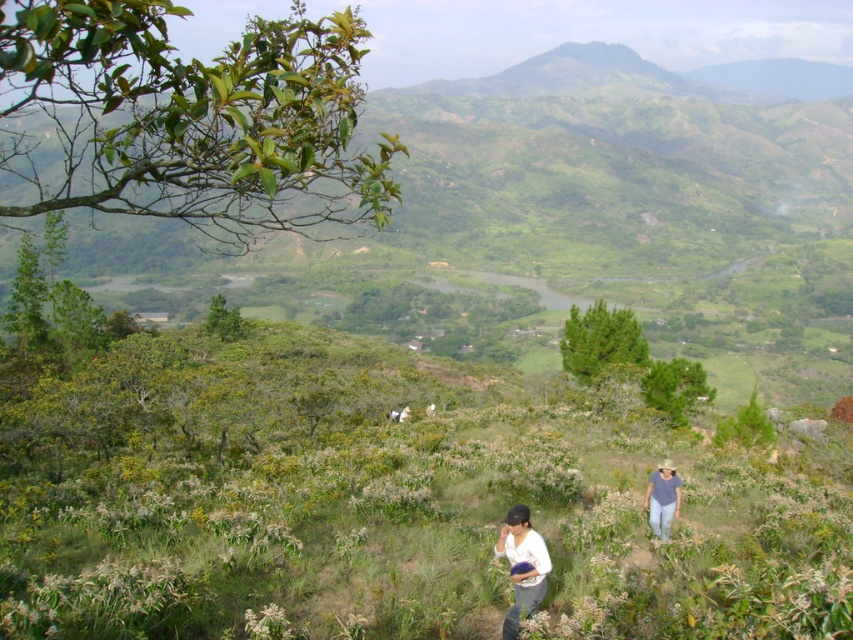
Question: Can you confirm if green leafy grass at center is positioned above denim shirt at lower right?

Choices:
 (A) yes
 (B) no

Answer: (A)

Question: Based on their relative distances, which object is nearer to the green leafy grass at center?

Choices:
 (A) white matte shirt at lower center
 (B) denim shirt at lower right

Answer: (A)

Question: Which point is closer to the camera?

Choices:
 (A) (517, 625)
 (B) (666, 490)
 (C) (624, 467)

Answer: (A)

Question: Which of the following is the farthest from the observer?

Choices:
 (A) green leafy grass at center
 (B) white matte shirt at lower center
 (C) denim shirt at lower right

Answer: (C)

Question: Does green leafy grass at center appear on the left side of white matte shirt at lower center?

Choices:
 (A) yes
 (B) no

Answer: (A)

Question: Is green leafy grass at center above white matte shirt at lower center?

Choices:
 (A) yes
 (B) no

Answer: (A)